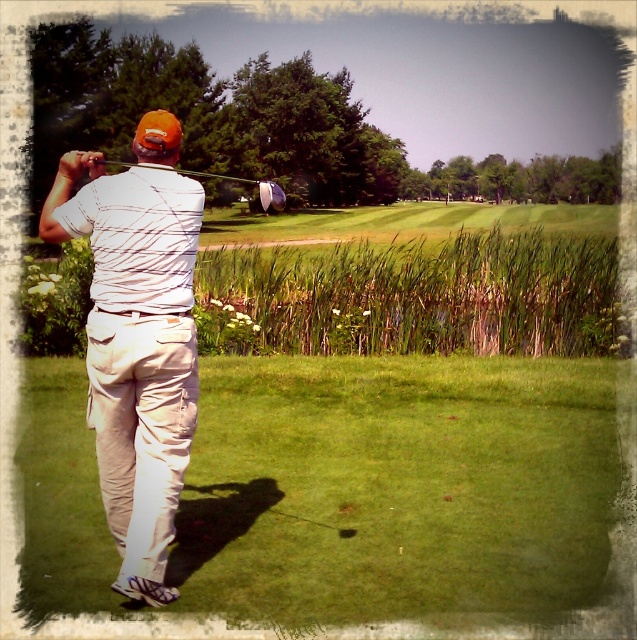
Who is higher up, white cotton shirt at center or metallic silver golf club at upper center?

metallic silver golf club at upper center is above.

Who is more distant from viewer, (82,163) or (182,173)?

The point (182,173) is more distant.

Is point (161, 227) behind point (262, 202)?

That is False.

At what (x,y) coordinates should I click in order to perform the action: click on white cotton shirt at center. Please return your answer as a coordinate pair (x, y). Looking at the image, I should click on (138, 337).

What do you see at coordinates (396, 486) in the screenshot? The width and height of the screenshot is (637, 640). I see `green grass at center` at bounding box center [396, 486].

Does green grass at center appear on the right side of white cotton shirt at center?

Indeed, green grass at center is positioned on the right side of white cotton shirt at center.

Which is behind, point (34, 497) or point (118, 577)?

Point (34, 497)

At what (x,y) coordinates should I click in order to perform the action: click on green grass at center. Please return your answer as a coordinate pair (x, y). Looking at the image, I should click on pyautogui.click(x=396, y=486).

Can you confirm if green grass at center is positioned to the left of metallic silver golf club at upper center?

No, green grass at center is not to the left of metallic silver golf club at upper center.

Does green grass at center appear over metallic silver golf club at upper center?

Actually, green grass at center is below metallic silver golf club at upper center.

Between point (482, 502) and point (261, 200), which one is positioned in front?

Point (482, 502) is in front.

Where is `green grass at center`? This screenshot has width=637, height=640. green grass at center is located at coordinates (396, 486).